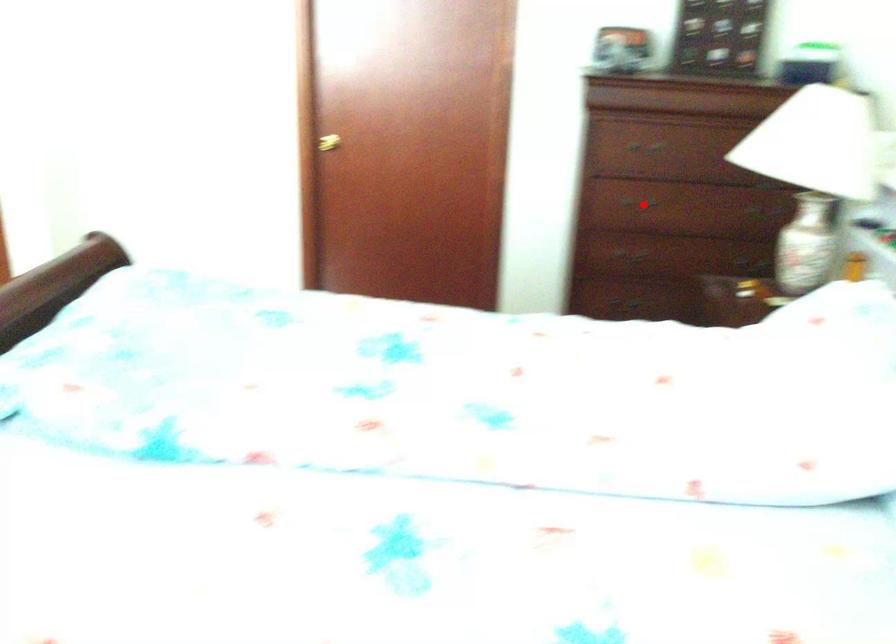
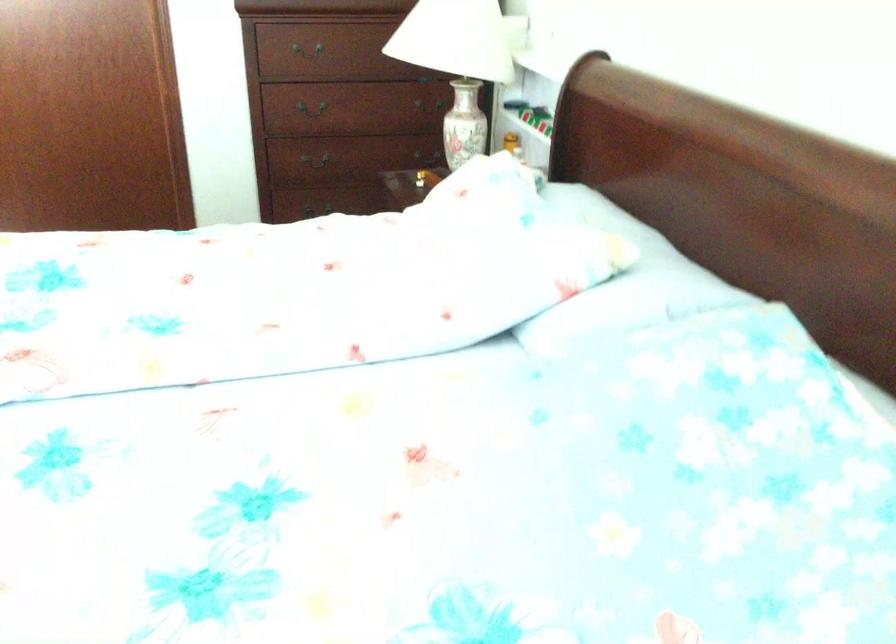
The point at the highlighted location is marked in the first image. Where is the corresponding point in the second image?

(313, 108)